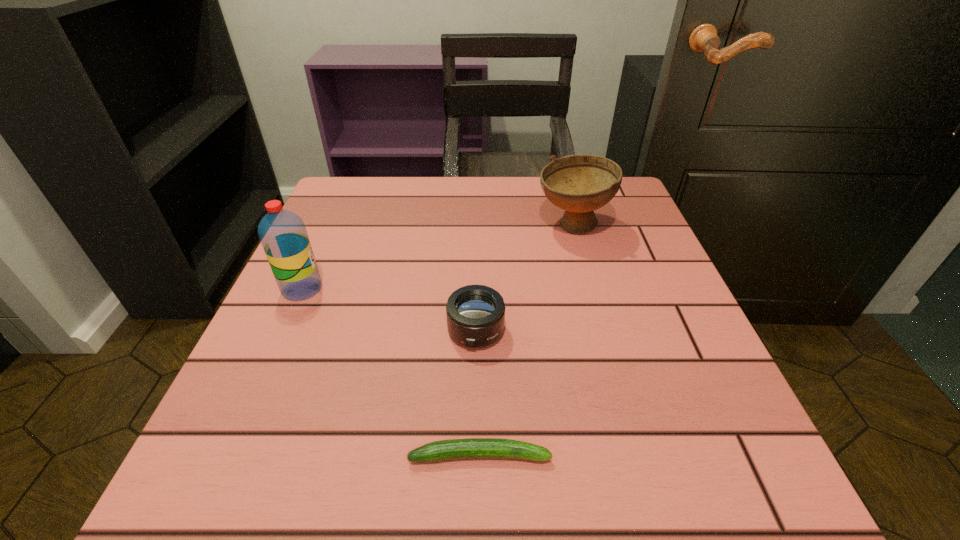
In order to click on vacant space situated 0.050m on the side of the telephoto lens with brand markings and control switches in this screenshot , I will do tap(475, 380).

Where is `free spot located 0.190m on the front-facing side of the shortest object`? The height and width of the screenshot is (540, 960). free spot located 0.190m on the front-facing side of the shortest object is located at coordinates (694, 455).

Identify the location of object that is at the far edge. (579, 184).

Find the location of `object present at the near edge`. object present at the near edge is located at coordinates 472,448.

You are a GUI agent. You are given a task and a screenshot of the screen. Output one action in this format:
    pyautogui.click(x=<x>, y=<y>)
    Task: Click on the object present at the left edge
    The width and height of the screenshot is (960, 540).
    Given the screenshot: What is the action you would take?
    pyautogui.click(x=282, y=233)

Locate an element on the screen. object that is at the right edge is located at coordinates (579, 184).

Locate an element on the screen. The image size is (960, 540). object at the far right corner is located at coordinates (579, 184).

This screenshot has width=960, height=540. In the image, there is a desktop. In order to click on vacant space at the near edge in this screenshot , I will do `click(320, 481)`.

You are a GUI agent. You are given a task and a screenshot of the screen. Output one action in this format:
    pyautogui.click(x=<x>, y=<y>)
    Task: Click on the vacant space at the left edge of the desktop
    This screenshot has width=960, height=540.
    Given the screenshot: What is the action you would take?
    pyautogui.click(x=338, y=267)

This screenshot has width=960, height=540. Find the location of `free region at the right edge of the desktop`. free region at the right edge of the desktop is located at coordinates (629, 270).